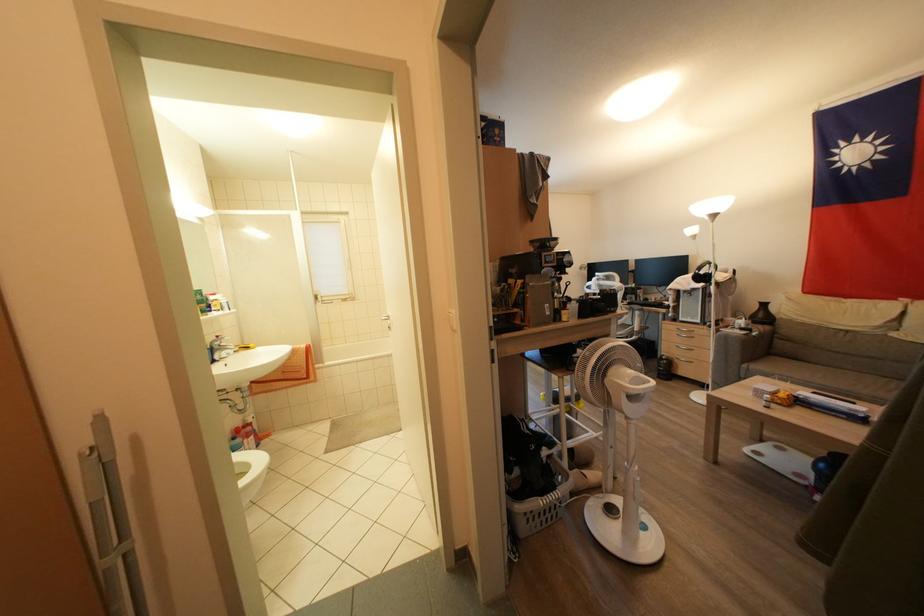
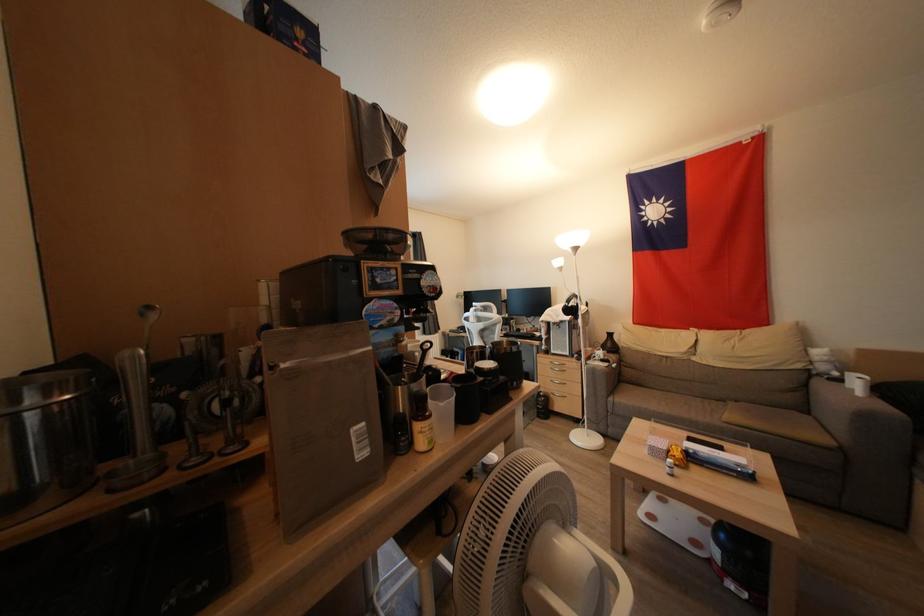
Question: How did the camera likely rotate?

Choices:
 (A) Left
 (B) Right
 (C) Up
 (D) Down

Answer: (B)